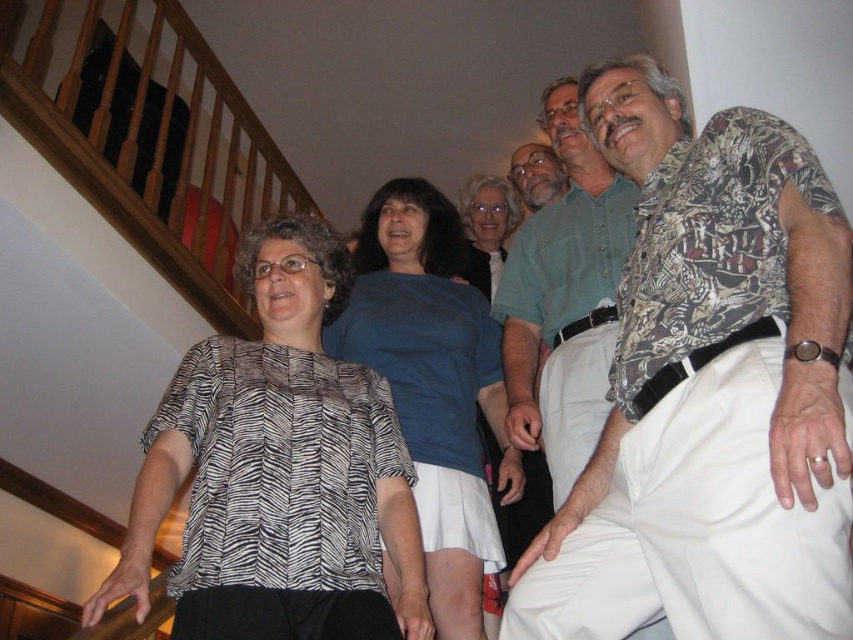
Which is behind, point (814, 180) or point (549, 419)?

The point (549, 419) is more distant.

Identify the location of printed cotton shirt at right. (705, 381).

Where is `printed cotton shirt at right`? printed cotton shirt at right is located at coordinates (705, 381).

Looking at this image, is matte blue shirt at center bigger than matte green shirt at upper center?

Indeed, matte blue shirt at center has a larger size compared to matte green shirt at upper center.

Where is `matte blue shirt at center`? The width and height of the screenshot is (853, 640). matte blue shirt at center is located at coordinates (486, 228).

What do you see at coordinates (486, 228) in the screenshot? I see `matte blue shirt at center` at bounding box center [486, 228].

This screenshot has width=853, height=640. I want to click on matte blue shirt at center, so tap(486, 228).

Which of these two, wooden at left or blue cotton shirt at center, stands shorter?

Standing shorter between the two is blue cotton shirt at center.

Is point (22, 88) closer to camera compared to point (412, 196)?

Yes, point (22, 88) is in front of point (412, 196).

This screenshot has height=640, width=853. Identify the location of wooden at left. (149, 138).

Identify the location of wooden at left. (149, 138).